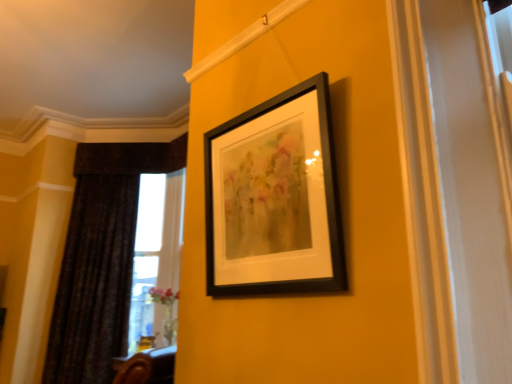
This screenshot has width=512, height=384. I want to click on dark velvet curtain at left, so click(94, 279).

The width and height of the screenshot is (512, 384). Describe the element at coordinates (94, 279) in the screenshot. I see `dark velvet curtain at left` at that location.

I want to click on black matte picture frame at upper center, so click(x=274, y=199).

What do you see at coordinates (274, 199) in the screenshot?
I see `black matte picture frame at upper center` at bounding box center [274, 199].

Where is `dark velvet curtain at left`? dark velvet curtain at left is located at coordinates (94, 279).

Is black matte picture frame at upper center to the left of dark velvet curtain at left from the viewer's perspective?

In fact, black matte picture frame at upper center is to the right of dark velvet curtain at left.

Between black matte picture frame at upper center and dark velvet curtain at left, which one is positioned in front?

black matte picture frame at upper center is more forward.

Does point (259, 254) lie in front of point (102, 262)?

Yes.

From the image's perspective, would you say black matte picture frame at upper center is shown under dark velvet curtain at left?

Incorrect, from the image's perspective, black matte picture frame at upper center is higher than dark velvet curtain at left.

From a real-world perspective, is black matte picture frame at upper center over dark velvet curtain at left?

Yes, from a real-world perspective, black matte picture frame at upper center is above dark velvet curtain at left.

Considering the relative sizes of black matte picture frame at upper center and dark velvet curtain at left in the image provided, is black matte picture frame at upper center thinner than dark velvet curtain at left?

Indeed, black matte picture frame at upper center has a lesser width compared to dark velvet curtain at left.

Which of these two, black matte picture frame at upper center or dark velvet curtain at left, stands taller?

Standing taller between the two is dark velvet curtain at left.

Can you confirm if black matte picture frame at upper center is bigger than dark velvet curtain at left?

Actually, black matte picture frame at upper center might be smaller than dark velvet curtain at left.

Do you think black matte picture frame at upper center is within dark velvet curtain at left, or outside of it?

The correct answer is: outside.

Is black matte picture frame at upper center far from dark velvet curtain at left?

Yes, black matte picture frame at upper center and dark velvet curtain at left are quite far apart.

Is black matte picture frame at upper center looking in the opposite direction of dark velvet curtain at left?

black matte picture frame at upper center is not turned away from dark velvet curtain at left.

What's the angular difference between black matte picture frame at upper center and dark velvet curtain at left's facing directions?

45.8 degrees separate the facing orientations of black matte picture frame at upper center and dark velvet curtain at left.

Locate an element on the screen. This screenshot has height=384, width=512. picture frame located above the dark velvet curtain at left (from the image's perspective) is located at coordinates (274, 199).

Can you confirm if dark velvet curtain at left is positioned to the right of black matte picture frame at upper center?

No, dark velvet curtain at left is not to the right of black matte picture frame at upper center.

From the picture: Between dark velvet curtain at left and black matte picture frame at upper center, which one is positioned in front?

black matte picture frame at upper center.

Considering the points (71, 374) and (213, 239), which point is behind, point (71, 374) or point (213, 239)?

Point (71, 374)

From the image's perspective, is dark velvet curtain at left beneath black matte picture frame at upper center?

Yes, from the image's perspective, dark velvet curtain at left is beneath black matte picture frame at upper center.

From a real-world perspective, is dark velvet curtain at left physically above black matte picture frame at upper center?

No, from a real-world perspective, dark velvet curtain at left is not over black matte picture frame at upper center

Considering the relative sizes of dark velvet curtain at left and black matte picture frame at upper center in the image provided, is dark velvet curtain at left wider than black matte picture frame at upper center?

Indeed, dark velvet curtain at left has a greater width compared to black matte picture frame at upper center.

Is dark velvet curtain at left taller than black matte picture frame at upper center?

Yes, dark velvet curtain at left is taller than black matte picture frame at upper center.

Can you confirm if dark velvet curtain at left is bigger than black matte picture frame at upper center?

Correct, dark velvet curtain at left is larger in size than black matte picture frame at upper center.

From the picture: Is dark velvet curtain at left not within black matte picture frame at upper center?

dark velvet curtain at left lies outside black matte picture frame at upper center's area.

Is dark velvet curtain at left with black matte picture frame at upper center?

No.

Is dark velvet curtain at left positioned with its back to black matte picture frame at upper center?

No, black matte picture frame at upper center is not at the back of dark velvet curtain at left.

You are a GUI agent. You are given a task and a screenshot of the screen. Output one action in this format:
    pyautogui.click(x=<x>, y=<y>)
    Task: Click on the curtain located underneath the black matte picture frame at upper center (from a real-world perspective)
    The width and height of the screenshot is (512, 384).
    Given the screenshot: What is the action you would take?
    pyautogui.click(x=94, y=279)

Locate an element on the screen. curtain that is on the left side of black matte picture frame at upper center is located at coordinates (94, 279).

Identify the location of curtain below the black matte picture frame at upper center (from a real-world perspective). Image resolution: width=512 pixels, height=384 pixels. (94, 279).